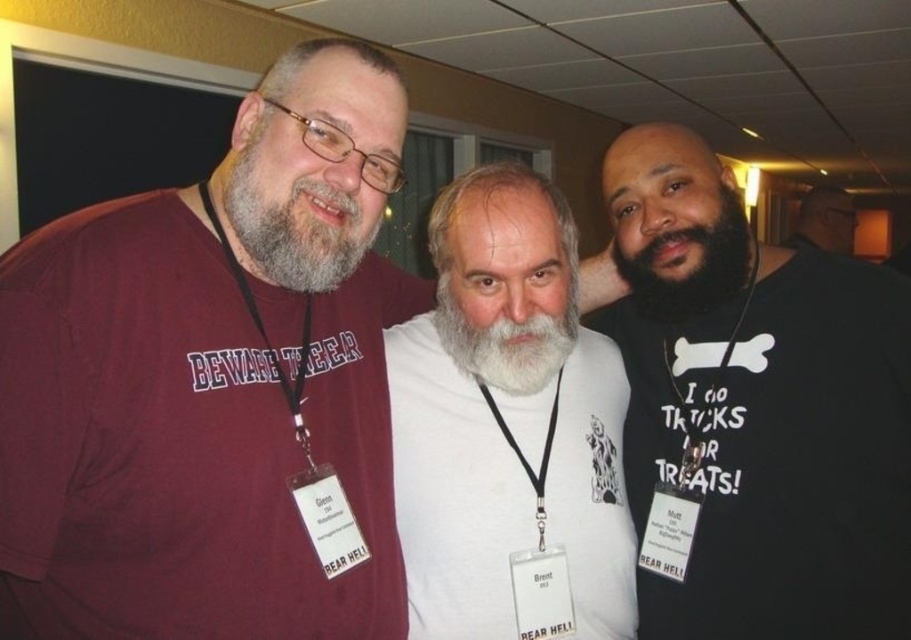
Image resolution: width=911 pixels, height=640 pixels. Describe the element at coordinates (507, 419) in the screenshot. I see `white matte t-shirt at center` at that location.

Between white matte t-shirt at center and whitesoftbeard at center, which one has less height?

whitesoftbeard at center is shorter.

The image size is (911, 640). In order to click on white matte t-shirt at center in this screenshot , I will do `click(507, 419)`.

Locate an element on the screen. The height and width of the screenshot is (640, 911). white matte t-shirt at center is located at coordinates (507, 419).

Can you confirm if white matte t-shirt at center is positioned below black matte shirt at center?

Yes, white matte t-shirt at center is below black matte shirt at center.

Is point (512, 266) in front of point (802, 212)?

Yes, it is in front of point (802, 212).

The image size is (911, 640). I want to click on white matte t-shirt at center, so click(507, 419).

Is point (705, 276) positioned before point (821, 208)?

That is True.

Measure the distance between point (x=656, y=307) and camera.

Point (x=656, y=307) and camera are 4.44 feet apart from each other.

Between point (653, 276) and point (801, 208), which one is positioned in front?

Positioned in front is point (653, 276).

Identify the location of black fuzzy beard at center. The height and width of the screenshot is (640, 911). (694, 268).